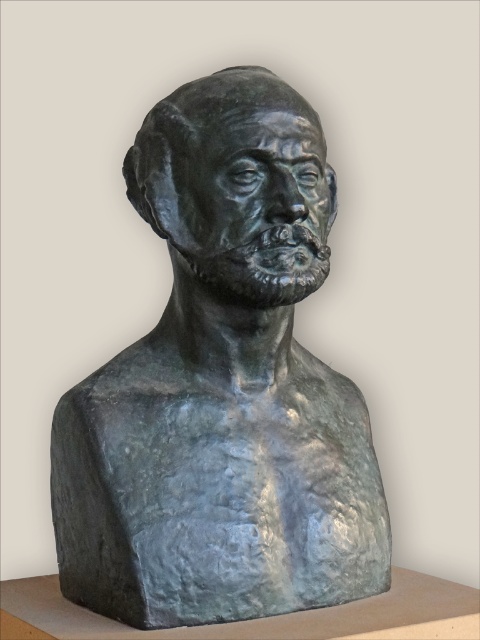
You are an art conservator assessing the space requirements for transporting two bronze pieces. You have a transport container that can accommodate items up to 1 meter in width. You observe the bronze bust at center and the bronze sculpture at center in the image. Can both items fit side by side within the container if placed adjacent to each other horizontally?

The bronze bust at center might be wider than bronze sculpture at center. Since the exact widths aren

In the scene shown: You are an art conservator examining the bronze bust sculpture. You notice two points on the sculpture at coordinates point (x=240, y=403) and point (x=226, y=160). Which point is closer to the viewer?

Point (x=226, y=160) is closer to the viewer because the Objects Description states that point (x=240, y=403) is behind point (x=226, y=160).